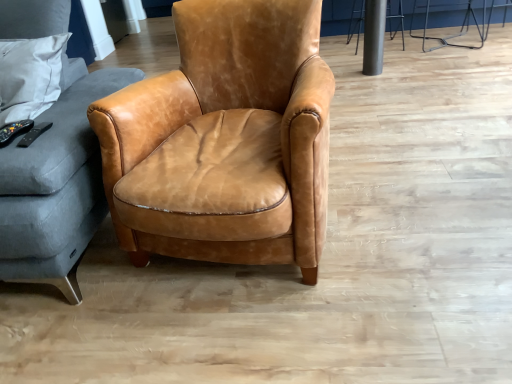
Question: Considering the relative sizes of metallic silver bar stool at upper right, which is counted as the 2th bar stool, starting from the left, and metallic silver bar stool at upper right, the first bar stool when ordered from left to right, in the image provided, is metallic silver bar stool at upper right, which is counted as the 2th bar stool, starting from the left, wider than metallic silver bar stool at upper right, the first bar stool when ordered from left to right,?

Choices:
 (A) yes
 (B) no

Answer: (A)

Question: Does metallic silver bar stool at upper right, which is counted as the 2th bar stool, starting from the left, have a smaller size compared to metallic silver bar stool at upper right, acting as the 2th bar stool starting from the right?

Choices:
 (A) no
 (B) yes

Answer: (A)

Question: Would you say metallic silver bar stool at upper right, which is counted as the first bar stool, starting from the right, is a long distance from metallic silver bar stool at upper right, acting as the 2th bar stool starting from the right?

Choices:
 (A) no
 (B) yes

Answer: (A)

Question: Is metallic silver bar stool at upper right, which is counted as the 2th bar stool, starting from the left, in contact with metallic silver bar stool at upper right, acting as the 2th bar stool starting from the right?

Choices:
 (A) yes
 (B) no

Answer: (B)

Question: Could metallic silver bar stool at upper right, acting as the 2th bar stool starting from the right, be considered to be inside metallic silver bar stool at upper right, which is counted as the first bar stool, starting from the right?

Choices:
 (A) no
 (B) yes

Answer: (A)

Question: From the image's perspective, would you say metallic silver bar stool at upper right, which is counted as the 2th bar stool, starting from the left, is shown under metallic silver bar stool at upper right, acting as the 2th bar stool starting from the right?

Choices:
 (A) yes
 (B) no

Answer: (A)

Question: Is metallic silver bar stool at upper right, which is counted as the first bar stool, starting from the right, wider than matte gray fabric studio couch at left?

Choices:
 (A) yes
 (B) no

Answer: (B)

Question: Considering the relative positions of metallic silver bar stool at upper right, which is counted as the first bar stool, starting from the right, and matte gray fabric studio couch at left in the image provided, is metallic silver bar stool at upper right, which is counted as the first bar stool, starting from the right, behind matte gray fabric studio couch at left?

Choices:
 (A) no
 (B) yes

Answer: (B)

Question: Is the depth of metallic silver bar stool at upper right, which is counted as the 2th bar stool, starting from the left, less than that of matte gray fabric studio couch at left?

Choices:
 (A) no
 (B) yes

Answer: (A)

Question: Considering the relative sizes of metallic silver bar stool at upper right, which is counted as the 2th bar stool, starting from the left, and matte gray fabric studio couch at left in the image provided, is metallic silver bar stool at upper right, which is counted as the 2th bar stool, starting from the left, bigger than matte gray fabric studio couch at left?

Choices:
 (A) yes
 (B) no

Answer: (B)

Question: Is matte gray fabric studio couch at left inside metallic silver bar stool at upper right, which is counted as the 2th bar stool, starting from the left?

Choices:
 (A) no
 (B) yes

Answer: (A)

Question: From a real-world perspective, does metallic silver bar stool at upper right, which is counted as the first bar stool, starting from the right, stand above matte gray fabric studio couch at left?

Choices:
 (A) yes
 (B) no

Answer: (B)

Question: Is metallic silver bar stool at upper right, the first bar stool when ordered from left to right, taller than matte gray fabric studio couch at left?

Choices:
 (A) yes
 (B) no

Answer: (B)